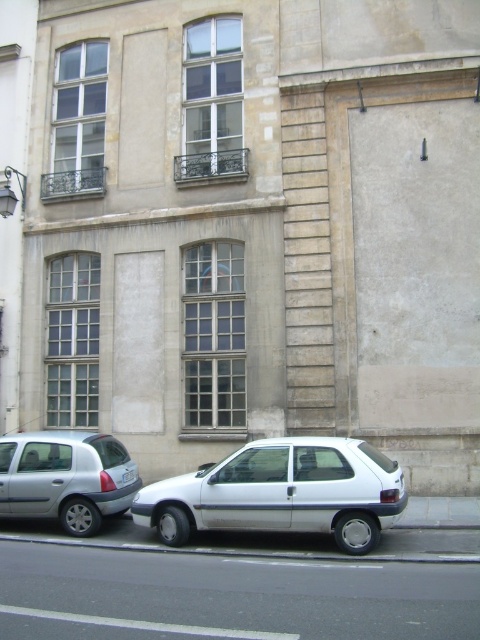
Question: Is white matte hatchback at center thinner than white plastic license plate at lower center?

Choices:
 (A) yes
 (B) no

Answer: (B)

Question: Is gray concrete curb at lower center to the left of white plastic license plate at lower center from the viewer's perspective?

Choices:
 (A) no
 (B) yes

Answer: (A)

Question: Does silver metallic minivan at lower left have a larger size compared to white plastic license plate at lower center?

Choices:
 (A) no
 (B) yes

Answer: (B)

Question: Which object is farther from the camera taking this photo?

Choices:
 (A) white matte hatchback at center
 (B) gray concrete curb at lower center

Answer: (B)

Question: Among these objects, which one is nearest to the camera?

Choices:
 (A) white plastic license plate at lower center
 (B) white matte hatchback at center
 (C) silver metallic minivan at lower left
 (D) gray concrete curb at lower center

Answer: (B)

Question: Estimate the real-world distances between objects in this image. Which object is closer to the white matte hatchback at center?

Choices:
 (A) gray concrete curb at lower center
 (B) silver metallic minivan at lower left
 (C) white plastic license plate at lower center

Answer: (A)